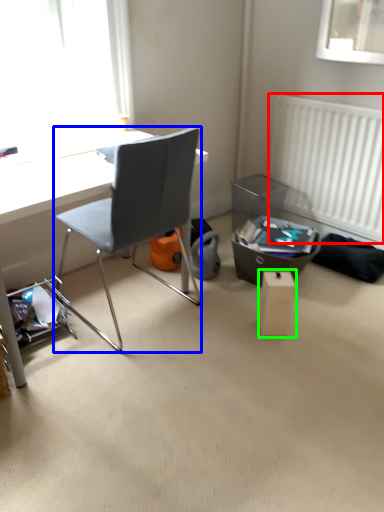
Question: Estimate the real-world distances between objects in this image. Which object is closer to radiator (highlighted by a red box), chair (highlighted by a blue box) or cardboard box (highlighted by a green box)?

Choices:
 (A) chair
 (B) cardboard box

Answer: (B)